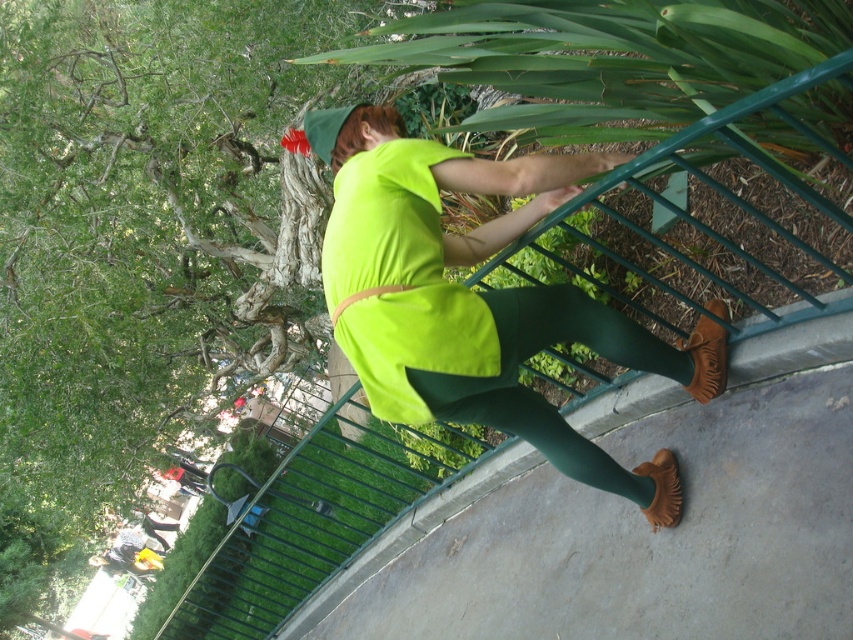
You are a costume designer observing the Peter Pan character in the image. Which part of the costume, the neon green fabric at center or the green matte leggings at center, extends higher on the body?

The neon green fabric at center extends higher on the body compared to the green matte leggings at center.

You are standing at the point closer to the viewer in the image. Which point are you at, point (349, 243) or point (595, 470)?

You are at point (349, 243) because it is closer to the viewer than point (595, 470).

You are a park visitor trying to reach a bench located behind the green metal railing. You see the neon green fabric safety vest at center and the green matte leggings at center. Which item is closer to you as you approach the railing?

The neon green fabric safety vest at center is closer to the viewer than the green matte leggings at center, so the neon green fabric safety vest at center is closer to you as you approach the railing.